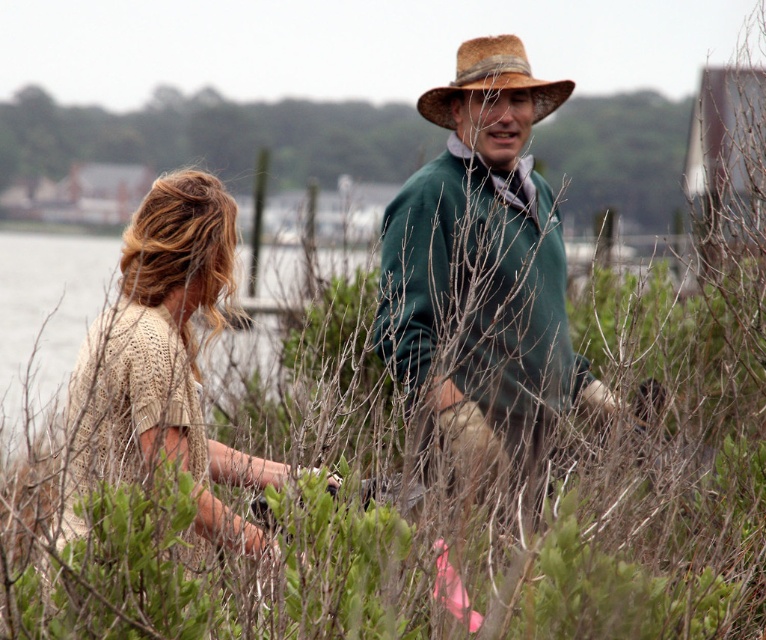
Question: Which point appears farthest from the camera in this image?

Choices:
 (A) (179, 228)
 (B) (480, 88)
 (C) (526, 276)

Answer: (B)

Question: Which point is closer to the camera taking this photo?

Choices:
 (A) tap(542, 116)
 (B) tap(526, 86)
 (C) tap(67, 502)
 (D) tap(424, 208)

Answer: (C)

Question: Does knitted beige sweater at center come behind green matte sweater at center?

Choices:
 (A) no
 (B) yes

Answer: (A)

Question: Is green matte sweater at center below brown straw cowboy hat at upper center?

Choices:
 (A) no
 (B) yes

Answer: (B)

Question: In this image, where is green matte sweater at center located relative to brown straw cowboy hat at upper center?

Choices:
 (A) left
 (B) right

Answer: (A)

Question: Which of the following is the closest to the observer?

Choices:
 (A) (466, 49)
 (B) (574, 403)
 (C) (125, 433)

Answer: (C)